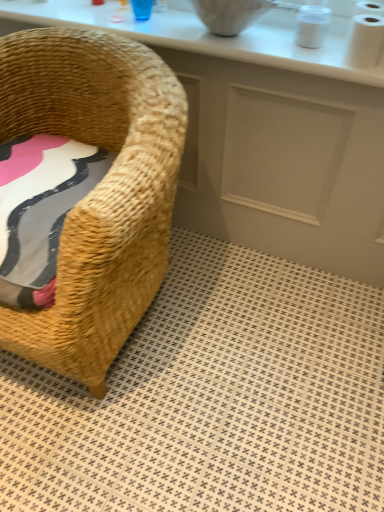
Question: Does white glossy counter at upper center have a lesser width compared to white glossy counter top at upper center?

Choices:
 (A) no
 (B) yes

Answer: (B)

Question: From the image's perspective, is white glossy counter at upper center above white glossy counter top at upper center?

Choices:
 (A) yes
 (B) no

Answer: (B)

Question: Does white glossy counter at upper center have a lesser height compared to white glossy counter top at upper center?

Choices:
 (A) no
 (B) yes

Answer: (A)

Question: Is white glossy counter at upper center with white glossy counter top at upper center?

Choices:
 (A) no
 (B) yes

Answer: (A)

Question: Could you tell me if white glossy counter at upper center is facing white glossy counter top at upper center?

Choices:
 (A) yes
 (B) no

Answer: (B)

Question: In the image, is woven straw chair at left on the left side or the right side of beige woven rug at lower left?

Choices:
 (A) right
 (B) left

Answer: (B)

Question: Would you say woven straw chair at left is inside or outside beige woven rug at lower left?

Choices:
 (A) outside
 (B) inside

Answer: (A)

Question: Looking at the image, does woven straw chair at left seem bigger or smaller compared to beige woven rug at lower left?

Choices:
 (A) small
 (B) big

Answer: (B)

Question: From a real-world perspective, is woven straw chair at left physically located above or below beige woven rug at lower left?

Choices:
 (A) above
 (B) below

Answer: (A)

Question: From a real-world perspective, relative to beige woven rug at lower left, is white glossy counter top at upper center vertically above or below?

Choices:
 (A) above
 (B) below

Answer: (A)

Question: Is point (185, 31) positioned closer to the camera than point (324, 323)?

Choices:
 (A) farther
 (B) closer

Answer: (B)

Question: In the image, is white glossy counter top at upper center on the left side or the right side of beige woven rug at lower left?

Choices:
 (A) left
 (B) right

Answer: (A)

Question: Based on their sizes in the image, would you say white glossy counter top at upper center is bigger or smaller than beige woven rug at lower left?

Choices:
 (A) big
 (B) small

Answer: (B)

Question: Looking at their shapes, would you say beige woven rug at lower left is wider or thinner than woven straw chair at left?

Choices:
 (A) thin
 (B) wide

Answer: (B)

Question: Is beige woven rug at lower left in front of or behind woven straw chair at left in the image?

Choices:
 (A) behind
 (B) front

Answer: (A)